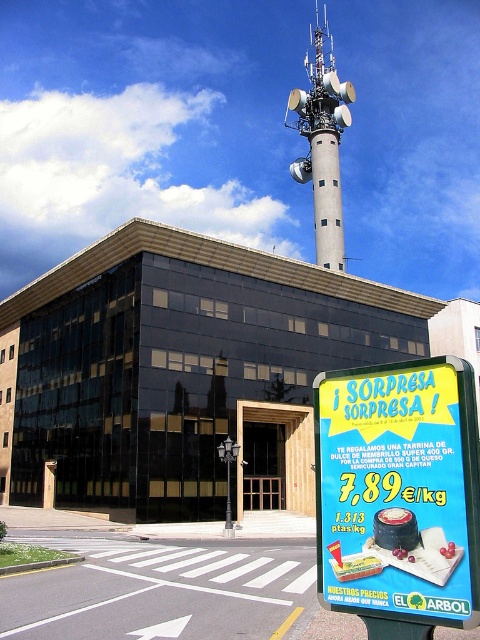
Question: Which object is closer to the camera taking this photo?

Choices:
 (A) metallic pole at center
 (B) gray concrete tower at upper center

Answer: (A)

Question: Which object is farther from the camera taking this photo?

Choices:
 (A) gray concrete tower at upper center
 (B) metallic pole at center
 (C) yellow paper sign at lower right

Answer: (A)

Question: From the image, what is the correct spatial relationship of yellow paper sign at lower right in relation to metallic pole at center?

Choices:
 (A) below
 (B) above

Answer: (B)

Question: Does yellow paper sign at lower right have a smaller size compared to metallic streetlight at center?

Choices:
 (A) yes
 (B) no

Answer: (A)

Question: Can you confirm if yellow paper sign at lower right is positioned below gray concrete tower at upper center?

Choices:
 (A) no
 (B) yes

Answer: (B)

Question: Estimate the real-world distances between objects in this image. Which object is closer to the yellow paper sign at lower right?

Choices:
 (A) gray concrete tower at upper center
 (B) metallic pole at center

Answer: (B)